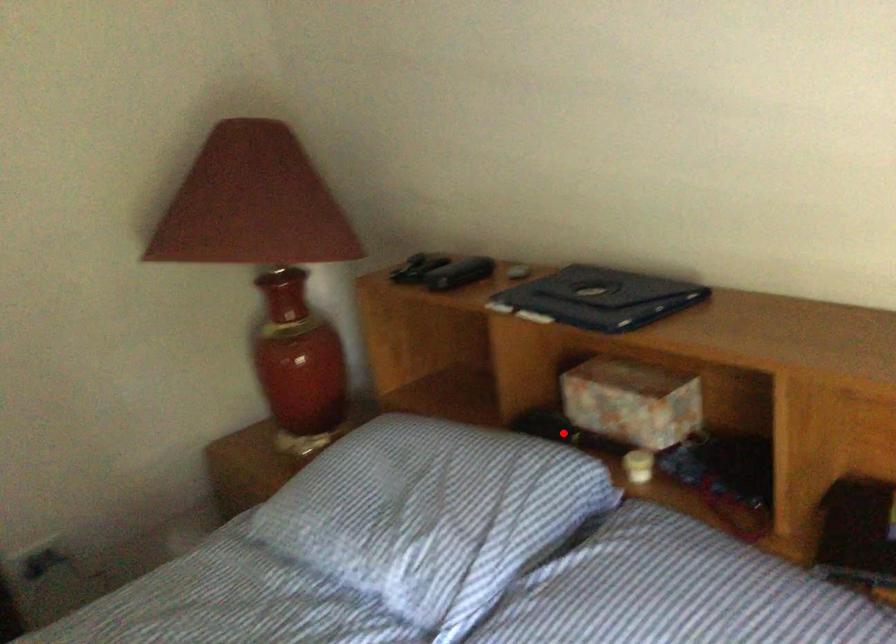
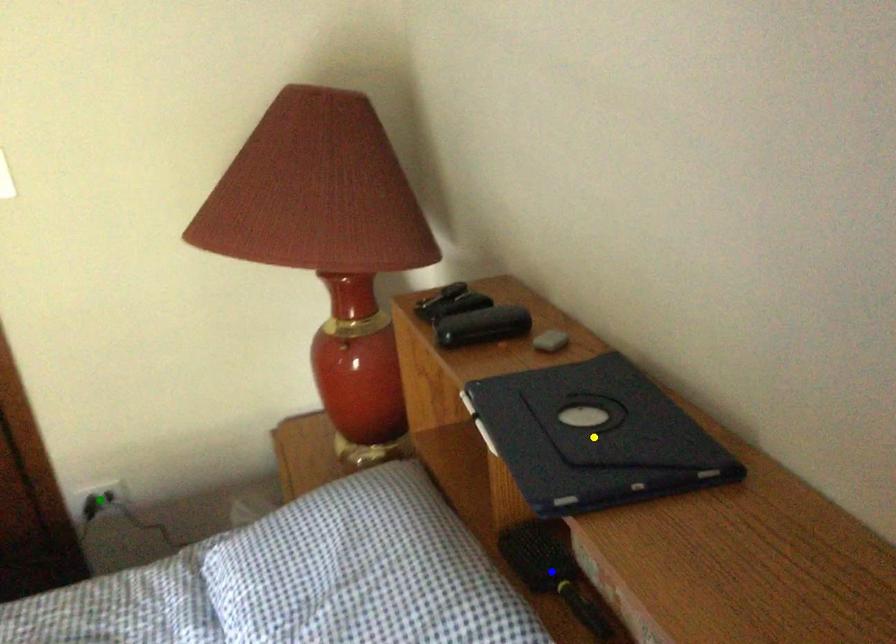
Question: I am providing you with two images of the same scene from different viewpoints. A red point is marked on the first image. You are given multiple points on the second image. Can you choose the point in image 2 that corresponds to the point in image 1?

Choices:
 (A) yellow point
 (B) green point
 (C) blue point

Answer: (C)